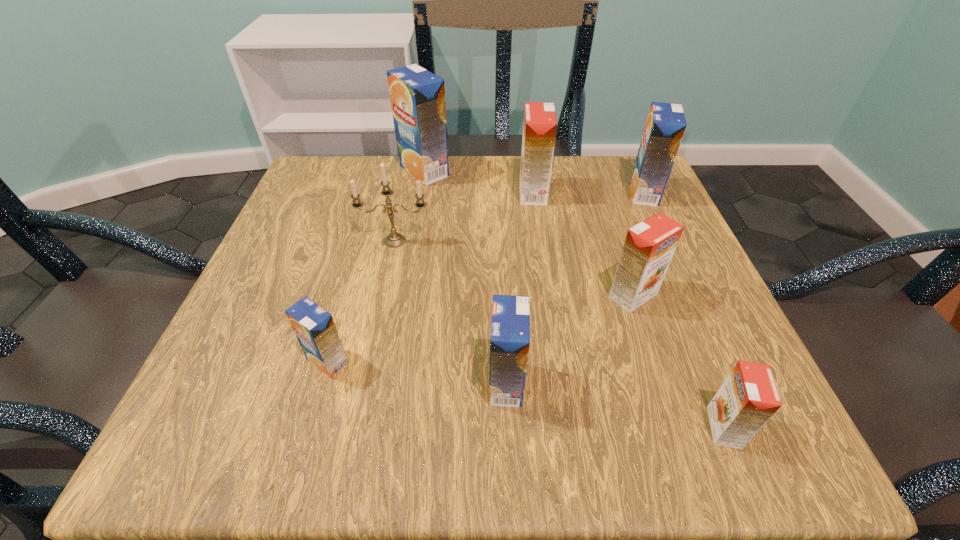
Locate an element on the screen. The width and height of the screenshot is (960, 540). vacant area that lies between the second nearest orange orange juice and the candle is located at coordinates (515, 268).

This screenshot has width=960, height=540. Find the location of `object that is the third closest to the tallest object`. object that is the third closest to the tallest object is located at coordinates (665, 125).

Find the location of a particular element. Image resolution: width=960 pixels, height=540 pixels. the second closest object to the second farthest orange orange juice is located at coordinates (510, 328).

The height and width of the screenshot is (540, 960). I want to click on the fourth closest orange juice to the nearest orange orange juice, so click(x=540, y=124).

Where is `orange juice that is the third closest to the biggest orange orange juice`? This screenshot has height=540, width=960. orange juice that is the third closest to the biggest orange orange juice is located at coordinates click(x=649, y=246).

Find the location of a particular element. Image resolution: width=960 pixels, height=540 pixels. blue orange_juice identified as the fourth closest to the second nearest orange orange juice is located at coordinates (314, 327).

Identify which blue orange_juice is the closest to the nearest orange orange juice. Please provide its 2D coordinates. Your answer should be formatted as a tuple, i.e. [(x, y)], where the tuple contains the x and y coordinates of a point satisfying the conditions above.

[(510, 328)]

Identify which orange orange juice is the second closest to the leftmost orange orange juice. Please provide its 2D coordinates. Your answer should be formatted as a tuple, i.e. [(x, y)], where the tuple contains the x and y coordinates of a point satisfying the conditions above.

[(748, 398)]

You are a GUI agent. You are given a task and a screenshot of the screen. Output one action in this format:
    pyautogui.click(x=<x>, y=<y>)
    Task: Click on the closest orange orange juice to the smallest orange orange juice
    The height and width of the screenshot is (540, 960).
    Given the screenshot: What is the action you would take?
    pyautogui.click(x=649, y=246)

Where is `vacant space that satisfies the following two spatial constraints: 1. on the front side of the third blue orange_juice from left to right; 2. on the left side of the smallest orange orange juice`? This screenshot has width=960, height=540. vacant space that satisfies the following two spatial constraints: 1. on the front side of the third blue orange_juice from left to right; 2. on the left side of the smallest orange orange juice is located at coordinates (508, 427).